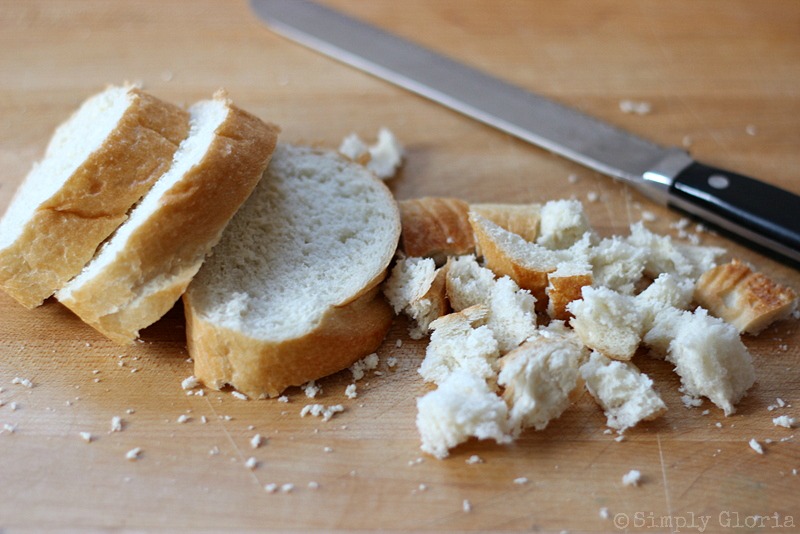
Identify the location of table. (370, 497).